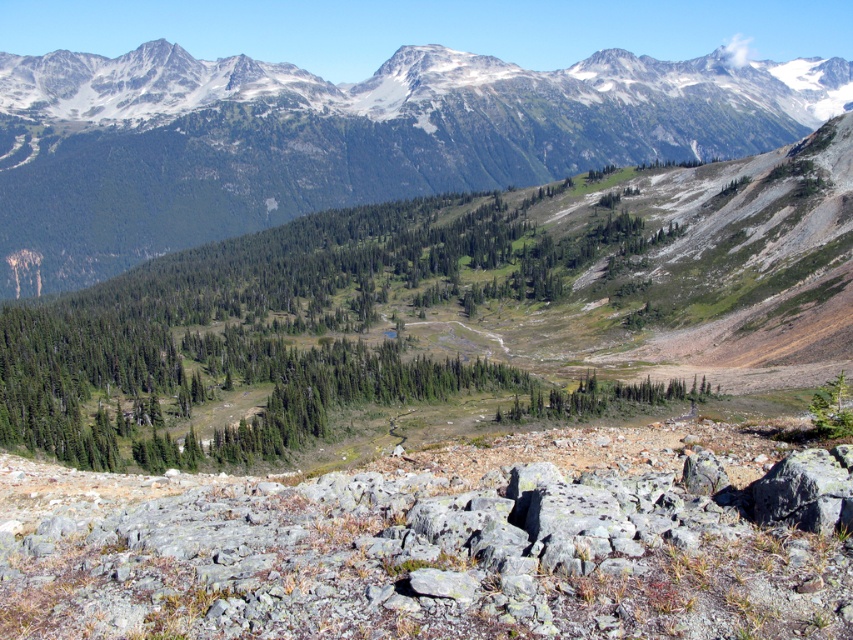
Can you confirm if gray rock at center is wider than green forested mountain range at upper center?

No.

Who is more forward, (780, 516) or (286, 218)?

Point (780, 516)

The height and width of the screenshot is (640, 853). In order to click on gray rock at center in this screenshot , I will do `click(415, 550)`.